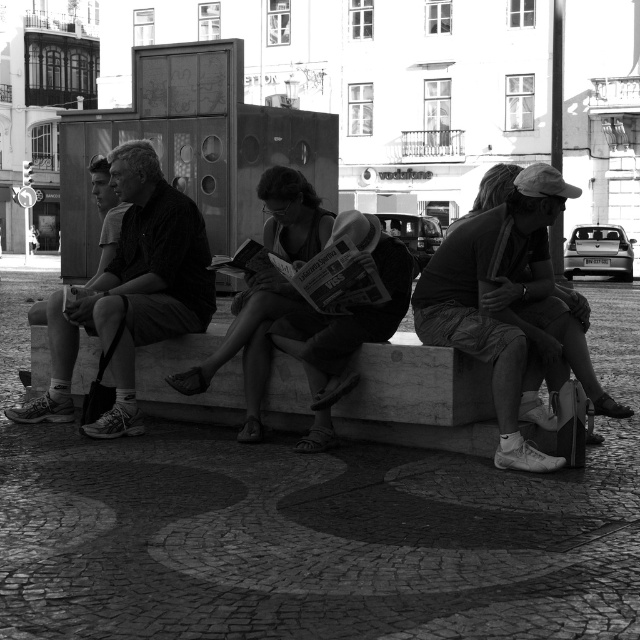
Measure the distance between point (x=90, y=406) and camera.

Point (x=90, y=406) and camera are 6.83 meters apart.

Is the position of smooth black shirt at left more distant than that of matte black dress at center?

Yes, smooth black shirt at left is behind matte black dress at center.

Between point (113, 337) and point (268, 186), which one is positioned in front?

Point (268, 186) is more forward.

Image resolution: width=640 pixels, height=640 pixels. Identify the location of smooth black shirt at left. (129, 296).

Can you confirm if marble bench at center is bigger than matte black dress at center?

Yes, marble bench at center is bigger than matte black dress at center.

Find the location of a particular element. The image size is (640, 640). marble bench at center is located at coordinates (419, 397).

Identify the location of marble bench at center. The image size is (640, 640). (419, 397).

Is point (252, 436) farther from viewer compared to point (490, 177)?

No, it is in front of (490, 177).

Find the location of `matte black dress at center`. matte black dress at center is located at coordinates (246, 342).

Find the location of a particular element. matte black dress at center is located at coordinates (246, 342).